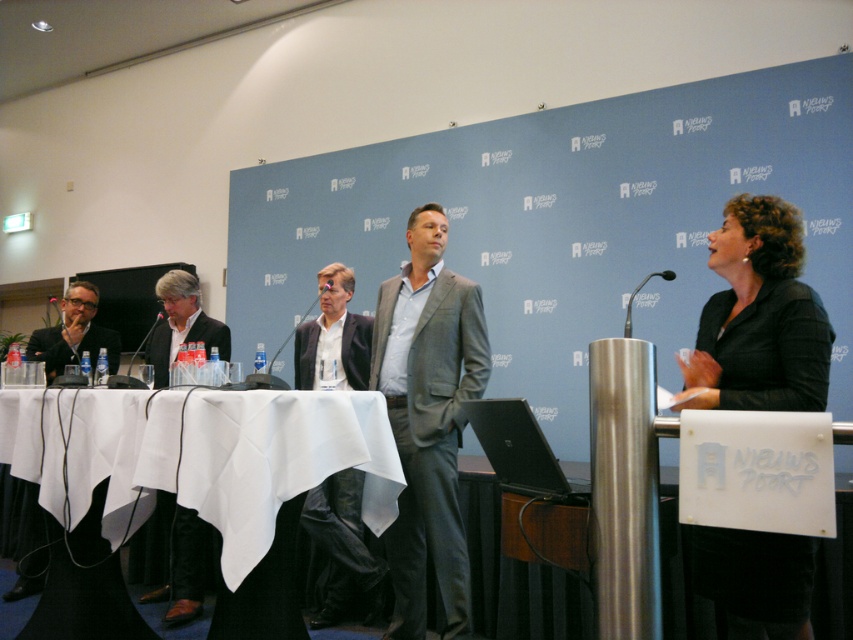
You are organizing a small meeting and need to ensure there is enough space for all attendees. You see the dark gray suit at left and the matte black microphone at center. Which object takes up more space in the image?

The dark gray suit at left is bigger than the matte black microphone at center, so it takes up more space in the image.

You are standing in the conference room and want to take a photo of both the point at position [334,358] and the point at [300,316]. Which point should you focus on first to ensure both are in sharp focus?

You should focus on the point at position [334,358] first because it is closer to the camera than the point at [300,316]. This ensures the closer point is in focus, and the farther point will also be sharp due to depth of field.